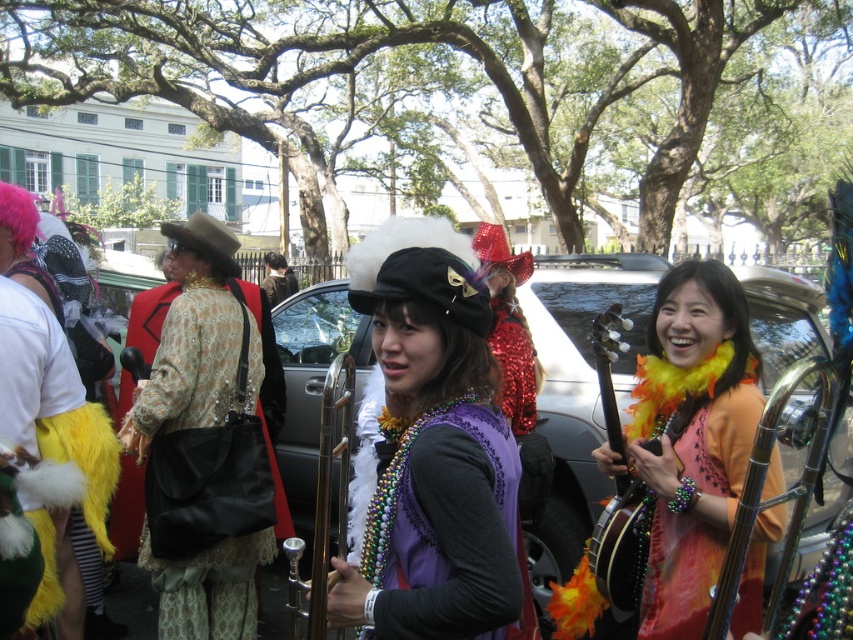
You are organizing a costume parade and need to ensure that all costumes are displayed properly. Given the purple velvet vest at center and the matte gold jacket at center, which costume requires a larger display stand?

The matte gold jacket at center requires a larger display stand since it is bigger than the purple velvet vest at center.

You are a photographer trying to capture a group photo of the purple velvet vest at center and the matte gold jacket at center. Your camera has a minimum focus distance of 2 meters. Can you take the photo without moving either of them?

The distance between the purple velvet vest at center and the matte gold jacket at center is 2.20 meters, which is greater than the camera minimum focus distance of 2 meters. Therefore, you can take the photo without moving them.

You are a costume designer observing the festive parade scene. You need to determine which costume component is narrower between the purple velvet vest at center and the matte gold jacket at center. Which one is narrower?

The purple velvet vest at center is narrower than the matte gold jacket at center according to the description.